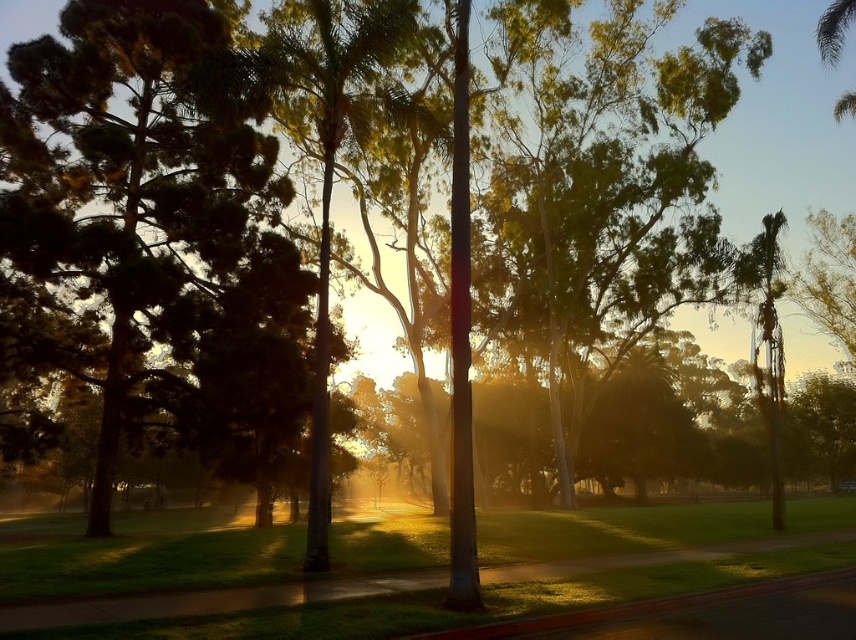
Is the position of green leafy palm tree at center more distant than that of green leafy palm tree at right?

No, green leafy palm tree at center is closer to the viewer.

What do you see at coordinates (333, 147) in the screenshot?
I see `green leafy palm tree at center` at bounding box center [333, 147].

Find the location of a particular element. This screenshot has height=640, width=856. green leafy palm tree at center is located at coordinates (333, 147).